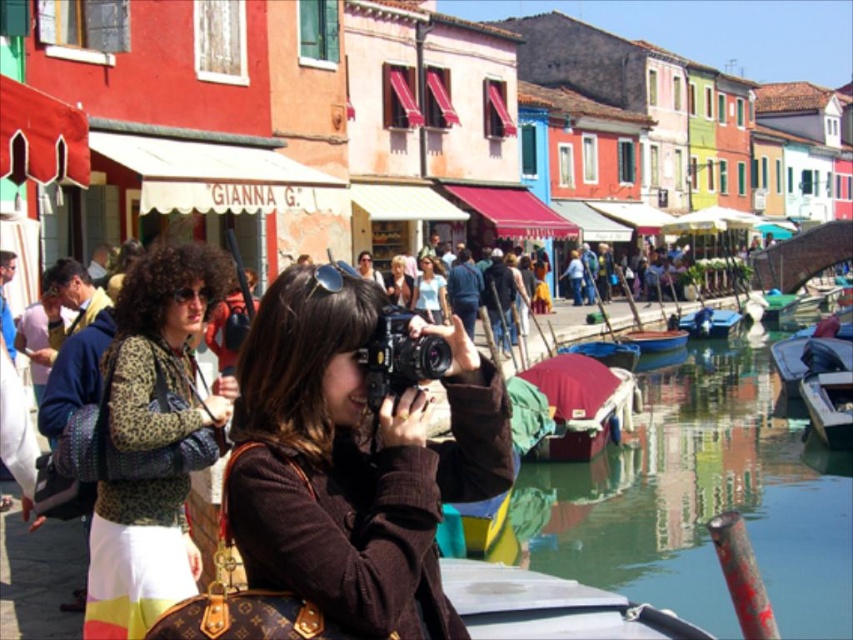
You are a tour guide leading a group of tourists on a walking tour in a European town. You need to ensure that your group can comfortably walk between the maroon fabric boat at center and the blue painted wooden boat at center without feeling cramped. The average width of a person is 0.5 meters. How many tourists can walk side by side between the two boats?

The distance between the maroon fabric boat at center and the blue painted wooden boat at center is 21.86 meters. To determine how many tourists can walk side by side, divide the distance by the average width of a person. 21.86 meters divided by 0.5 meters per person equals approximately 43.72. Since you can only have whole people, the maximum number of tourists that can walk side by side between the two boats is 43.

You are a tourist standing next to the maroon fabric boat at center. You want to take a photo of it with your camera. The camera is 44.72 meters away. Is the camera within the typical range of a standard camera lens to focus on the boat?

The maroon fabric boat at center and camera are 44.72 meters apart from each other. Standard camera lenses can focus up to around 100 meters, so the camera is within range to focus on the maroon fabric boat at center.